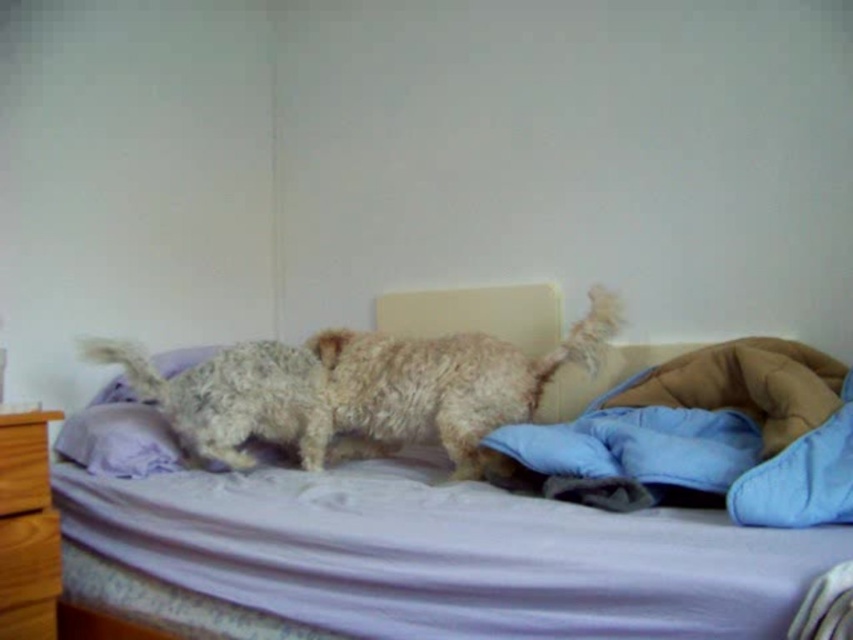
You are trying to decide if a small blanket can fit over both the fuzzy beige dog at center and the brown wooden dresser at lower left. Based on their sizes, can the blanket cover both?

The fuzzy beige dog at center is wider than the brown wooden dresser at lower left, so a small blanket might not be sufficient to cover both objects entirely unless it is large enough to accommodate the dog first, which is the larger of the two.

Based on the scene description, can you determine which object is bigger between the fuzzy beige dog at center and the brown wooden dresser at lower left?

The fuzzy beige dog at center has a larger size compared to the brown wooden dresser at lower left, so the dog is bigger.

You are moving furniture in a room and need to place a new rug. The rug is the same size as the brown wooden dresser at lower left. Can the rug fit under the purple fabric bed at center?

The purple fabric bed at center has a larger size compared to brown wooden dresser at lower left, so the rug, which is the same size as the brown wooden dresser at lower left, can fit under the purple fabric bed at center since it is smaller than the bed.